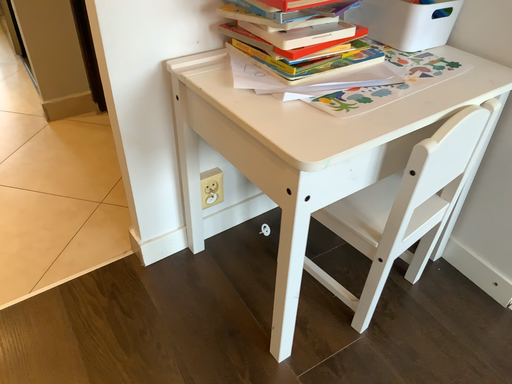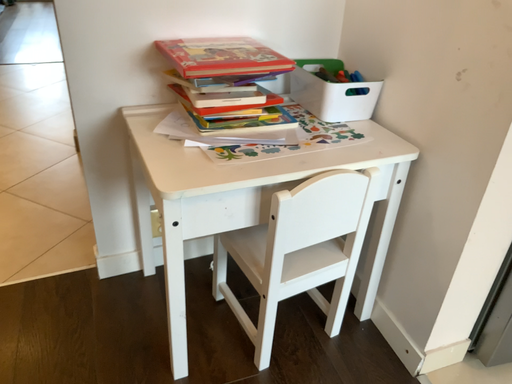
Question: How did the camera likely rotate when shooting the video?

Choices:
 (A) rotated right
 (B) rotated left

Answer: (B)